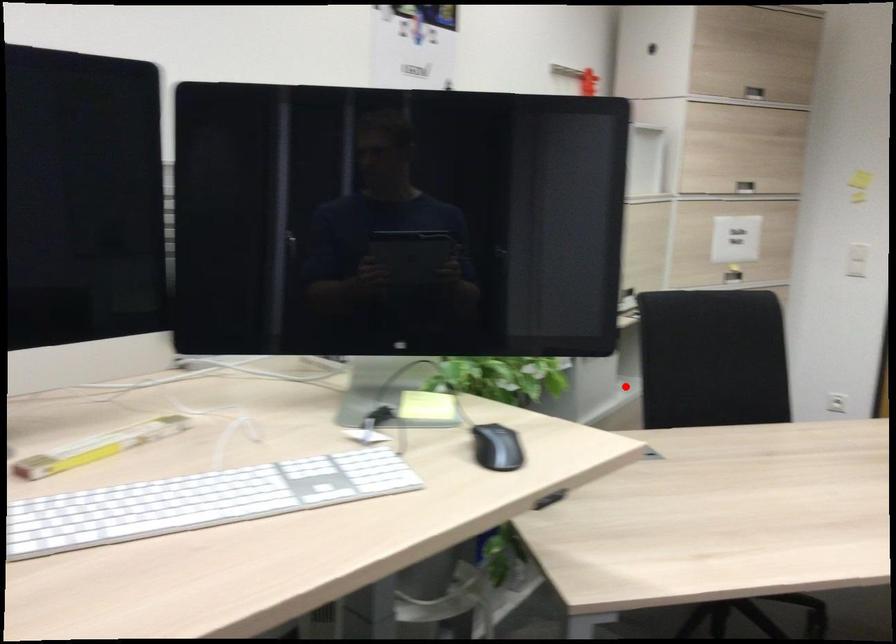
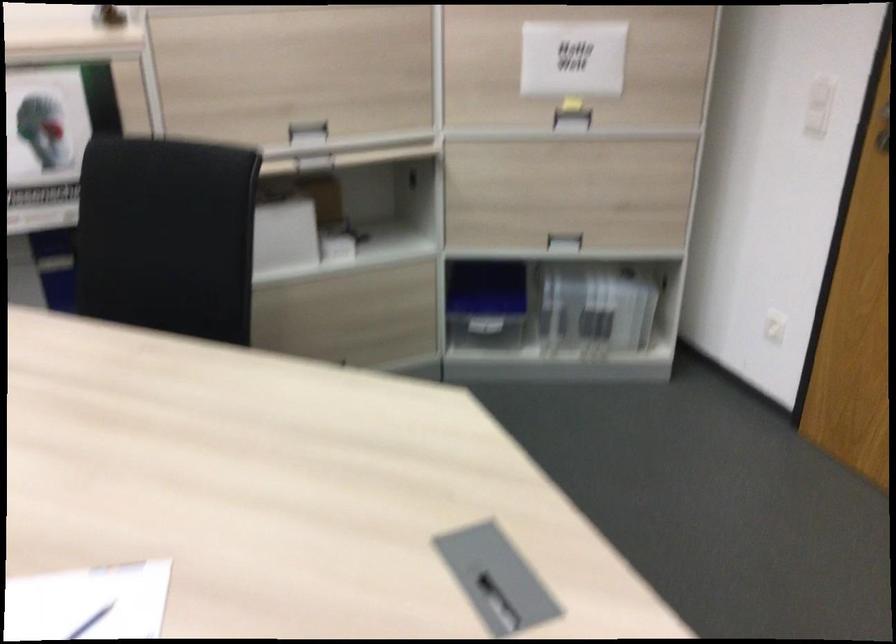
Locate, in the second image, the point that corresponds to the highlighted location in the first image.

(337, 247)